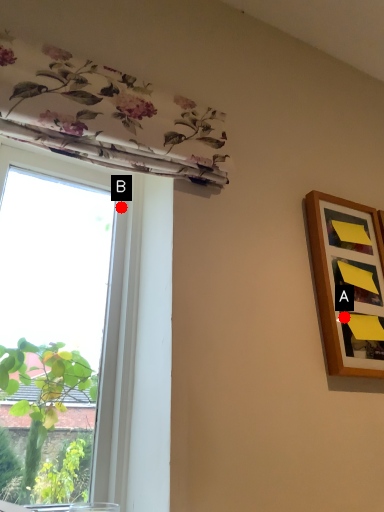
Question: Two points are circled on the image, labeled by A and B beside each circle. Among these points, which one is farthest from the camera?

Choices:
 (A) A is further
 (B) B is further

Answer: (B)